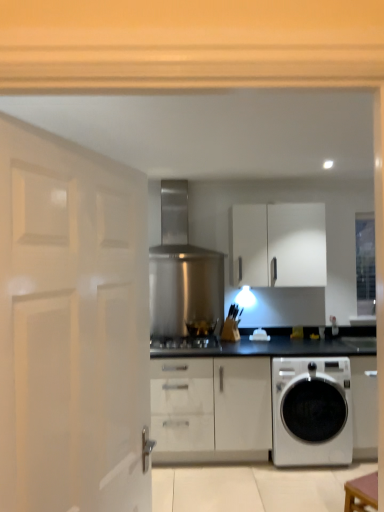
Question: Is black glass stove at center in contact with stainless steel exhaust hood at center?

Choices:
 (A) no
 (B) yes

Answer: (A)

Question: Is black glass stove at center not within stainless steel exhaust hood at center?

Choices:
 (A) yes
 (B) no

Answer: (A)

Question: From a real-world perspective, is black glass stove at center physically above stainless steel exhaust hood at center?

Choices:
 (A) yes
 (B) no

Answer: (B)

Question: Could stainless steel exhaust hood at center be considered to be inside black glass stove at center?

Choices:
 (A) yes
 (B) no

Answer: (B)

Question: From the image's perspective, is black glass stove at center over stainless steel exhaust hood at center?

Choices:
 (A) no
 (B) yes

Answer: (A)

Question: Is black glass stove at center aimed at stainless steel exhaust hood at center?

Choices:
 (A) no
 (B) yes

Answer: (A)

Question: Is black glass stove at center a part of white glossy door at left?

Choices:
 (A) yes
 (B) no

Answer: (B)

Question: Is white glossy door at left wider than black glass stove at center?

Choices:
 (A) yes
 (B) no

Answer: (B)

Question: From the image's perspective, is white glossy door at left below black glass stove at center?

Choices:
 (A) no
 (B) yes

Answer: (A)

Question: From a real-world perspective, is white glossy door at left positioned over black glass stove at center based on gravity?

Choices:
 (A) no
 (B) yes

Answer: (B)

Question: Is white glossy door at left looking in the opposite direction of black glass stove at center?

Choices:
 (A) no
 (B) yes

Answer: (A)

Question: Considering the relative sizes of white glossy door at left and black glass stove at center in the image provided, is white glossy door at left taller than black glass stove at center?

Choices:
 (A) yes
 (B) no

Answer: (A)

Question: Can you confirm if satin silver gas stove at center is positioned to the right of white glossy washing machine at lower right?

Choices:
 (A) no
 (B) yes

Answer: (A)